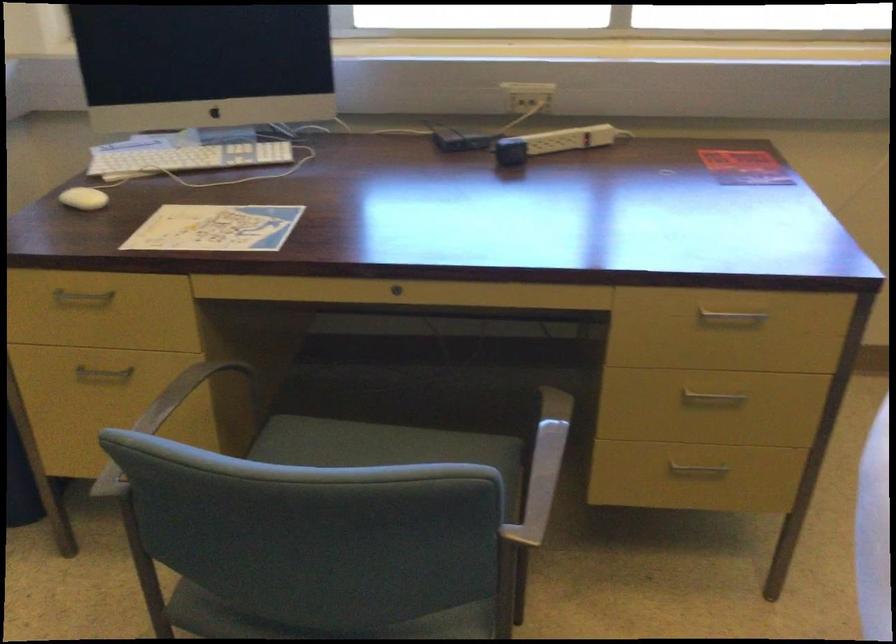
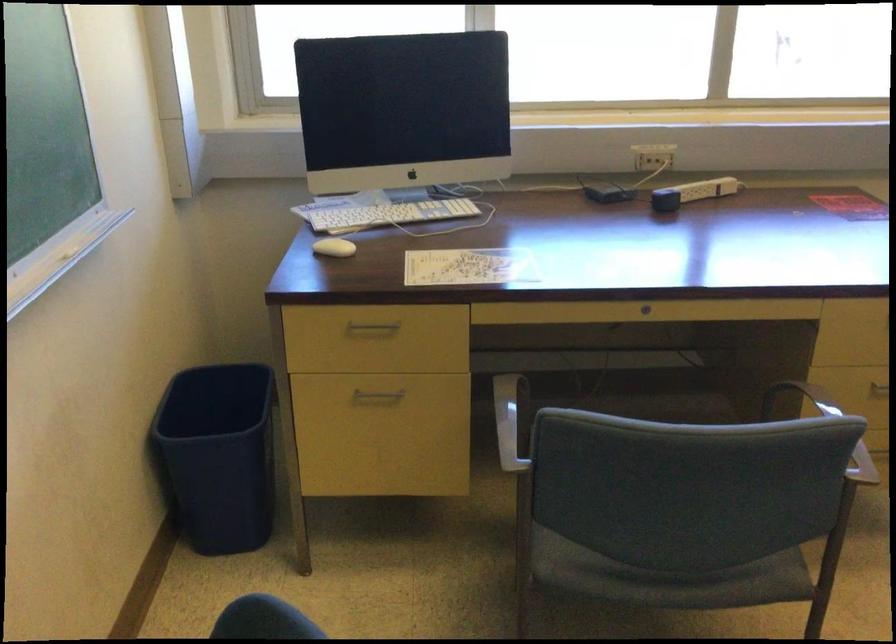
In the second image, find the point that corresponds to point 528,100 in the first image.

(658, 156)